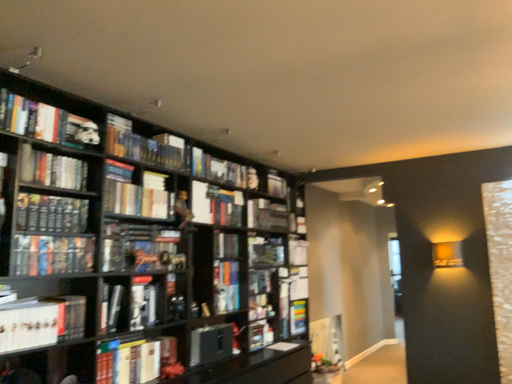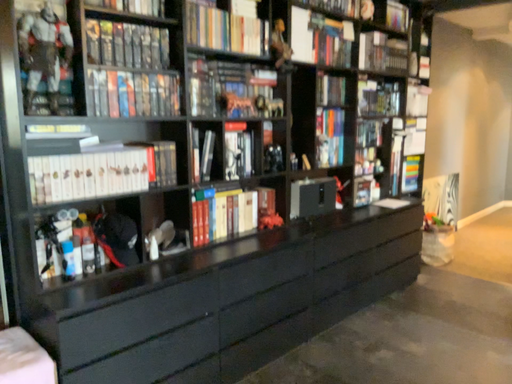
Question: Which way did the camera rotate in the video?

Choices:
 (A) rotated left
 (B) rotated right

Answer: (A)